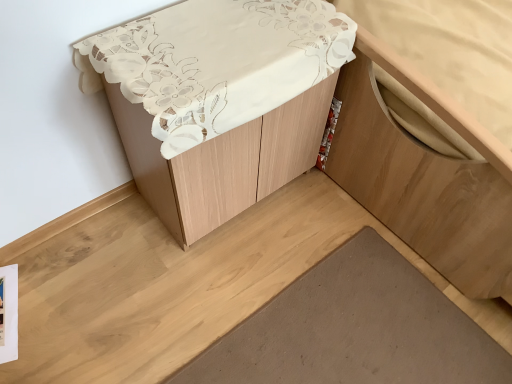
In order to click on vacant space in between brown matte wood plank at lower center and matte white cabinet at center in this screenshot , I will do `click(244, 264)`.